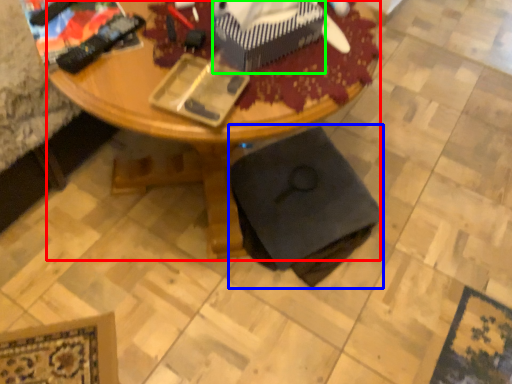
Question: Which is nearer to the desk (highlighted by a red box)? swivel chair (highlighted by a blue box) or box (highlighted by a green box).

Choices:
 (A) swivel chair
 (B) box

Answer: (A)